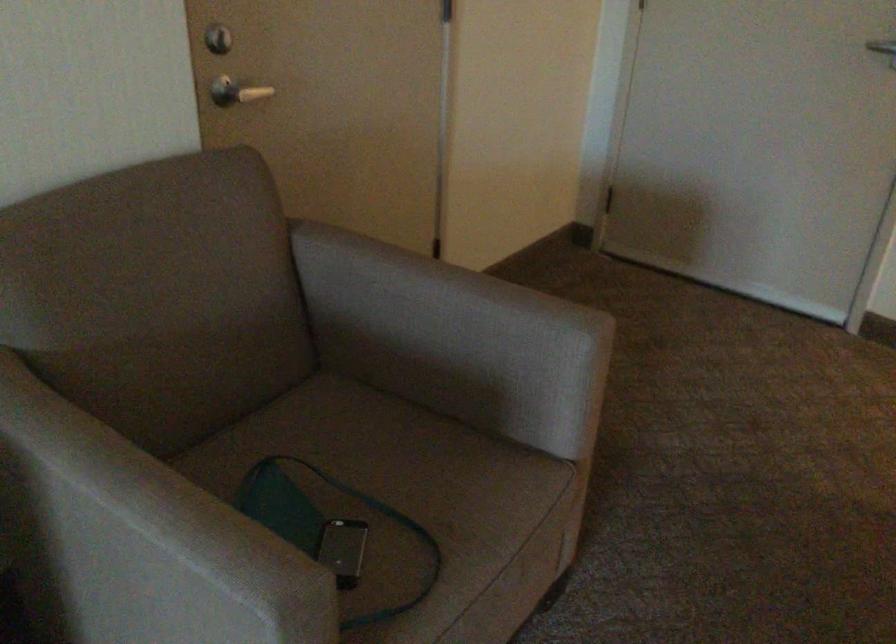
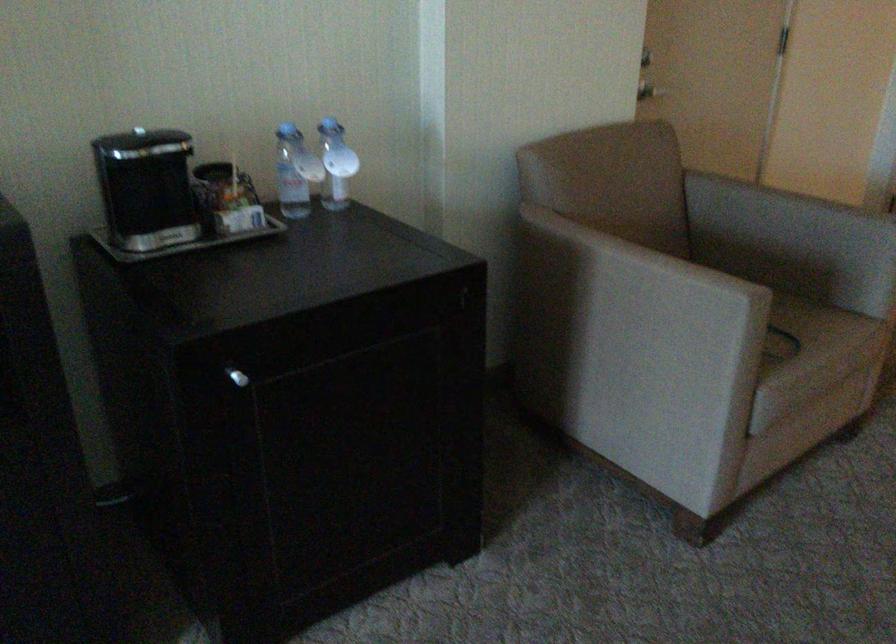
Question: I am providing you with two images of the same scene from different viewpoints. Which of the following objects are not visible in image2?

Choices:
 (A) red soap pump
 (B) green bag strap
 (C) chair armrest
 (D) dark paper cup

Answer: (B)